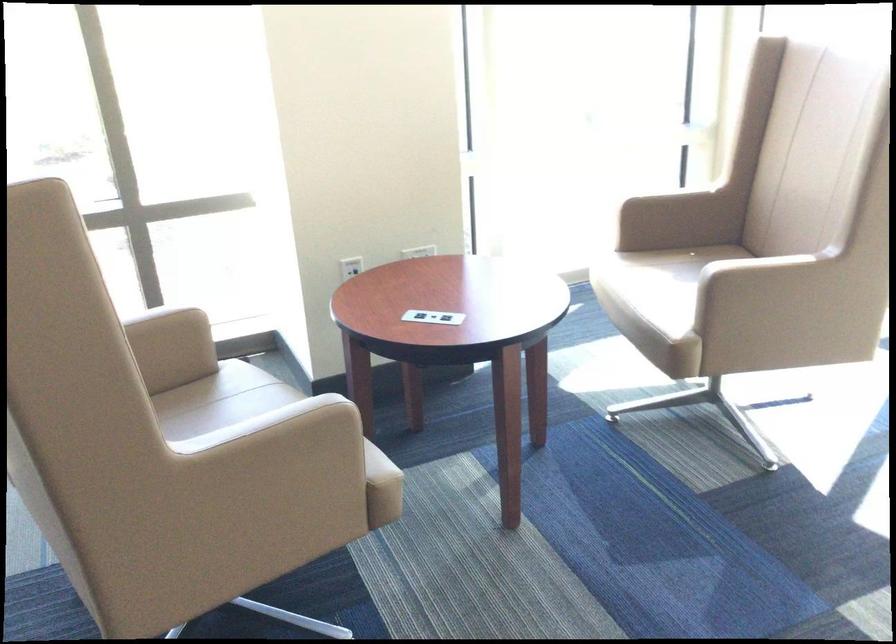
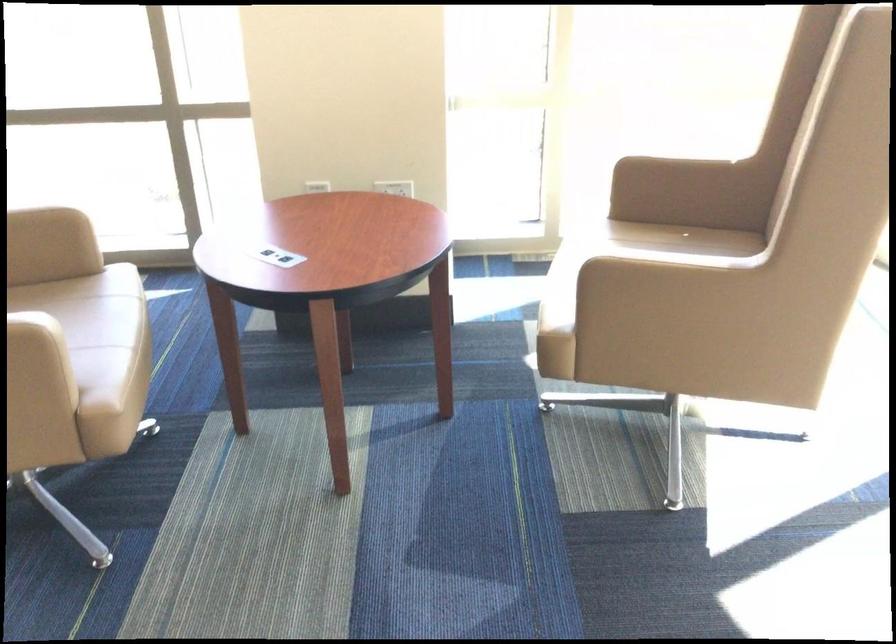
What movement of the cameraman would produce the second image?

The movement direction of the cameraman is right, forward.